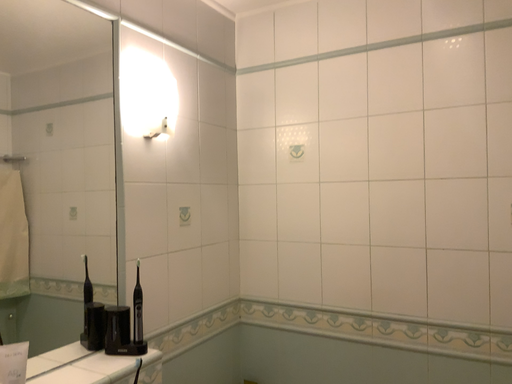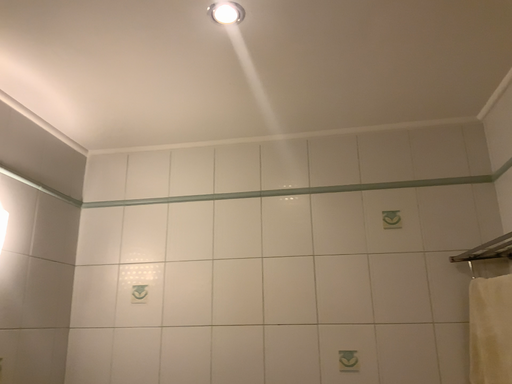
Question: Which way did the camera rotate in the video?

Choices:
 (A) rotated right
 (B) rotated left

Answer: (A)